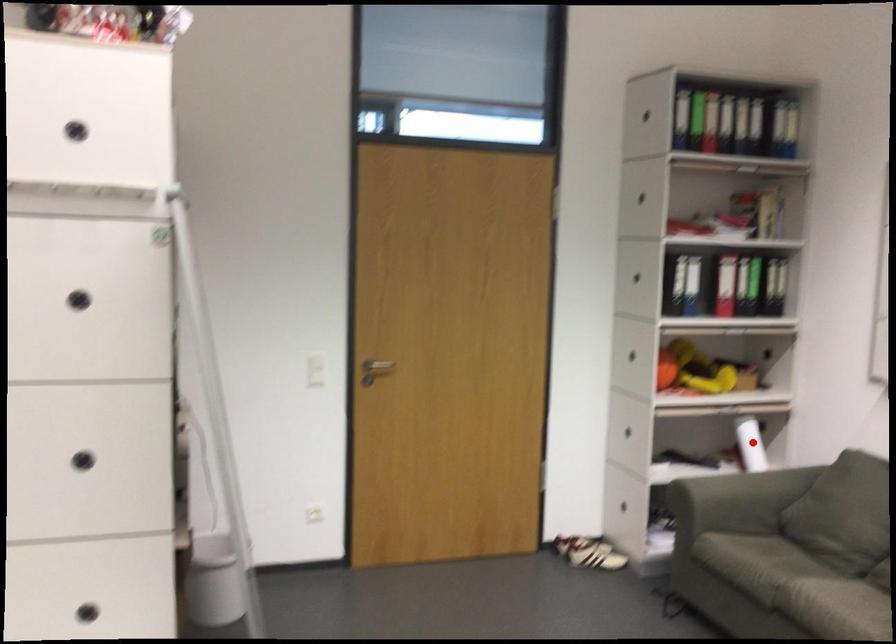
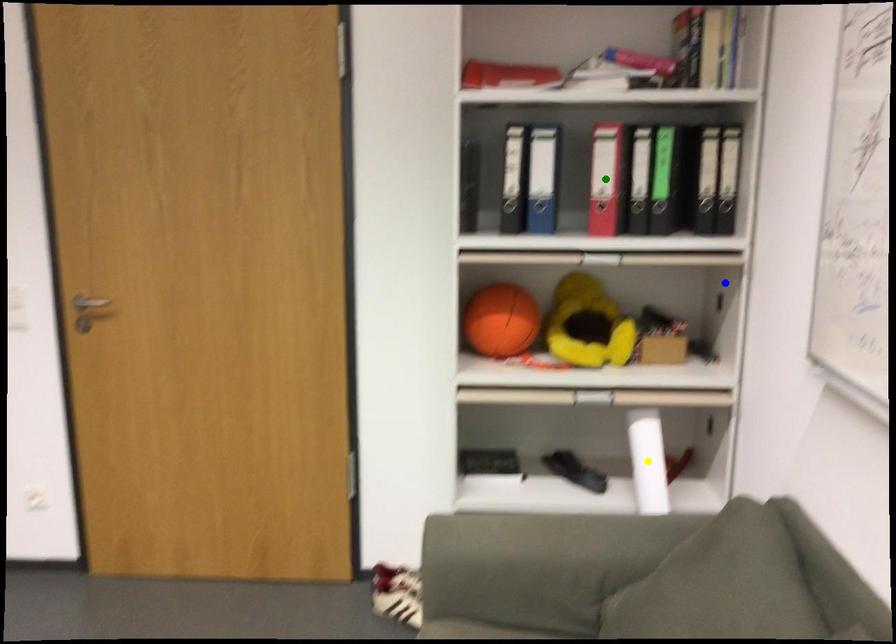
Question: I am providing you with two images of the same scene from different viewpoints. A red point is marked on the first image. You are given multiple points on the second image. Which point in image 2 represents the same 3d spot as the red point in image 1?

Choices:
 (A) yellow point
 (B) green point
 (C) blue point

Answer: (A)